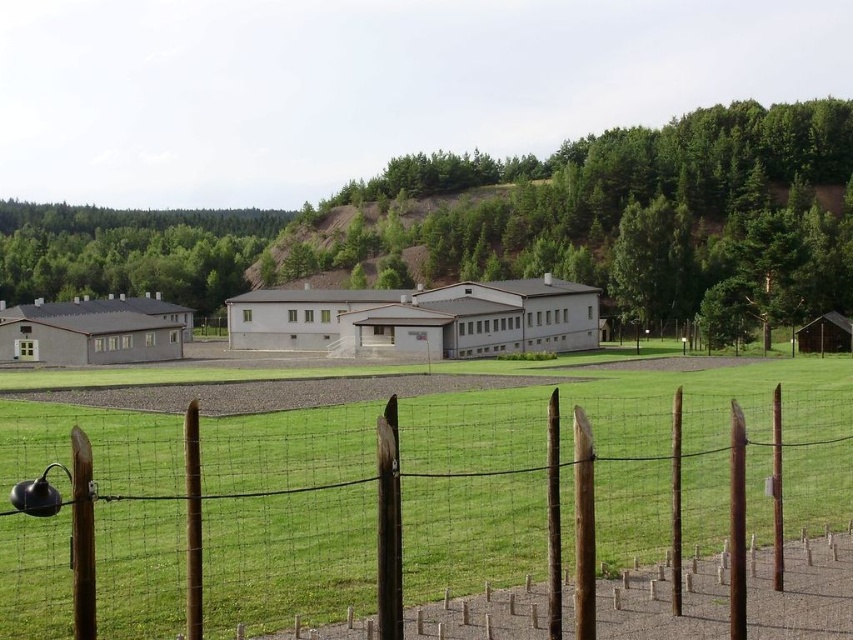
Question: Observing the image, what is the correct spatial positioning of brown wooden fence at lower center in reference to white matte building at center?

Choices:
 (A) right
 (B) left

Answer: (A)

Question: Which object is positioned farthest from the brown wooden fence at lower center?

Choices:
 (A) green leafy tree at center
 (B) green leafy tree at upper left
 (C) white matte building at center

Answer: (B)

Question: Which point is farther from the camera taking this photo?

Choices:
 (A) (341, 346)
 (B) (207, 269)
 (C) (648, 284)
 (D) (310, 612)

Answer: (B)

Question: Does green leafy tree at center appear on the right side of green leafy tree at upper left?

Choices:
 (A) no
 (B) yes

Answer: (B)

Question: Which point is closer to the camera?

Choices:
 (A) (189, 292)
 (B) (299, 280)
 (C) (369, 292)

Answer: (C)

Question: Is brown wooden fence at lower center to the right of green leafy tree at upper left from the viewer's perspective?

Choices:
 (A) no
 (B) yes

Answer: (B)